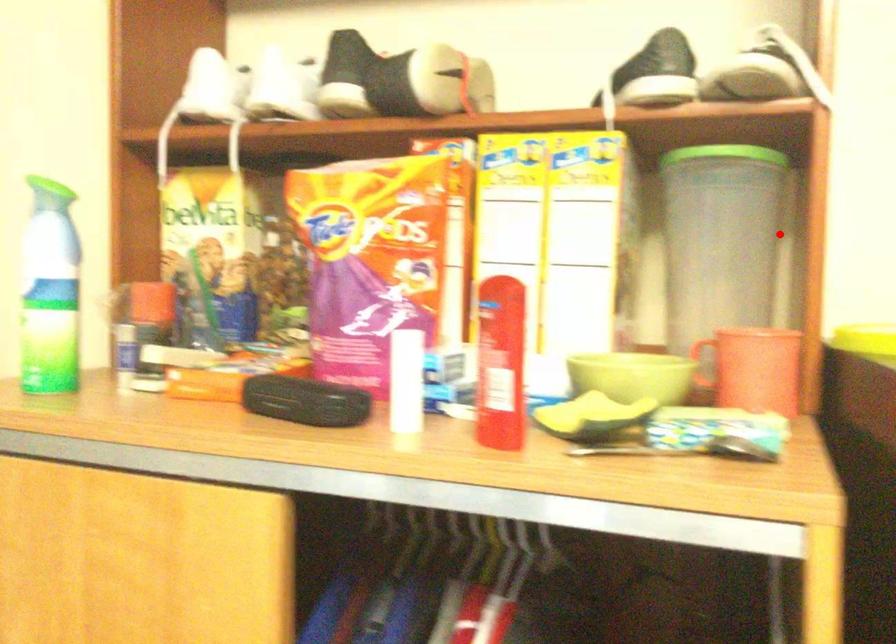
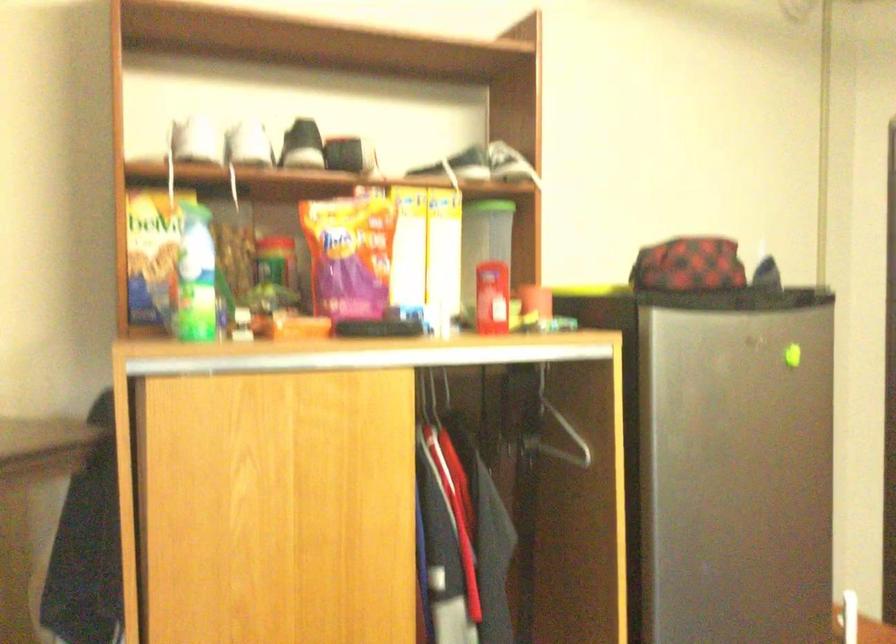
The point at the highlighted location is marked in the first image. Where is the corresponding point in the second image?

(483, 243)